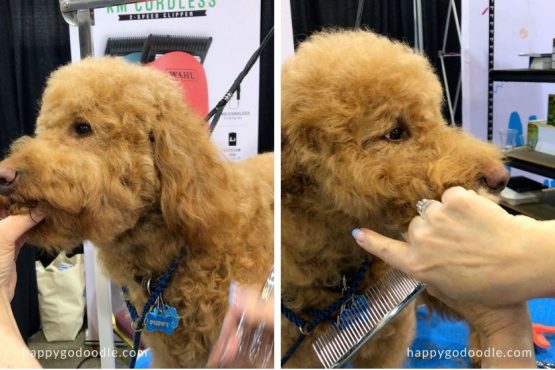
This screenshot has height=370, width=555. Find the location of `wall`. wall is located at coordinates (523, 16), (245, 25).